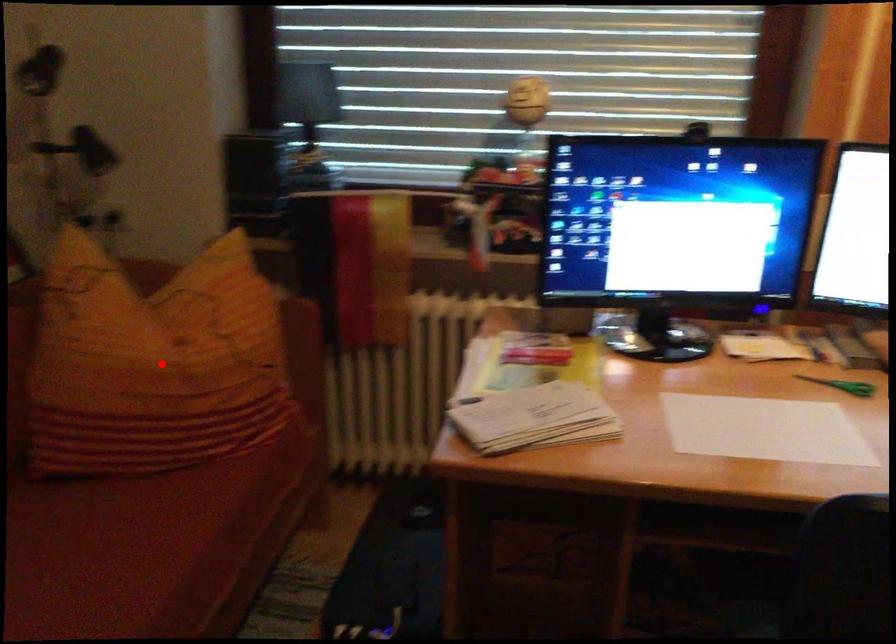
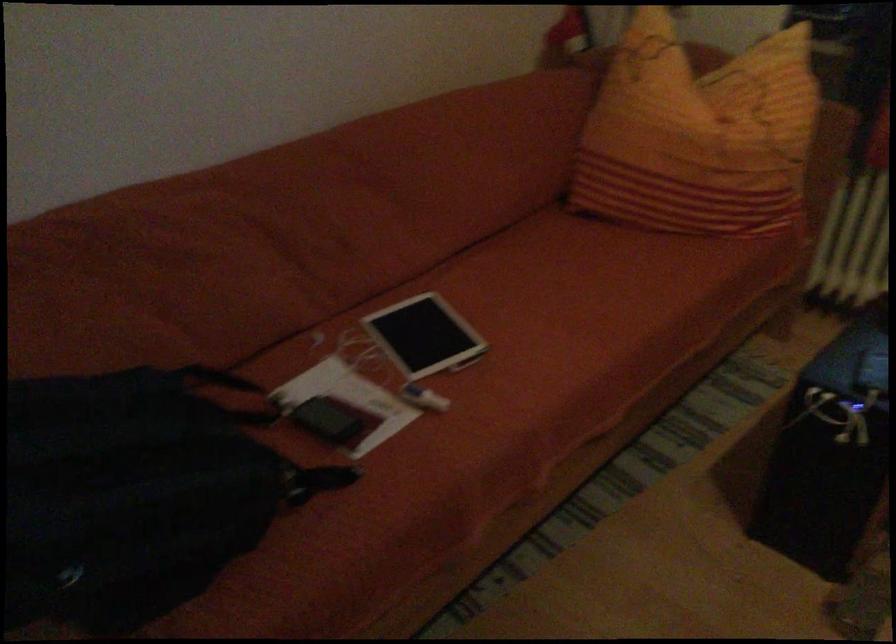
Question: A red point is marked in image1. In image2, is the corresponding 3D point closer to the camera or farther? Reply with the corresponding letter.

Choices:
 (A) The corresponding 3D point is closer.
 (B) The corresponding 3D point is farther.

Answer: (B)